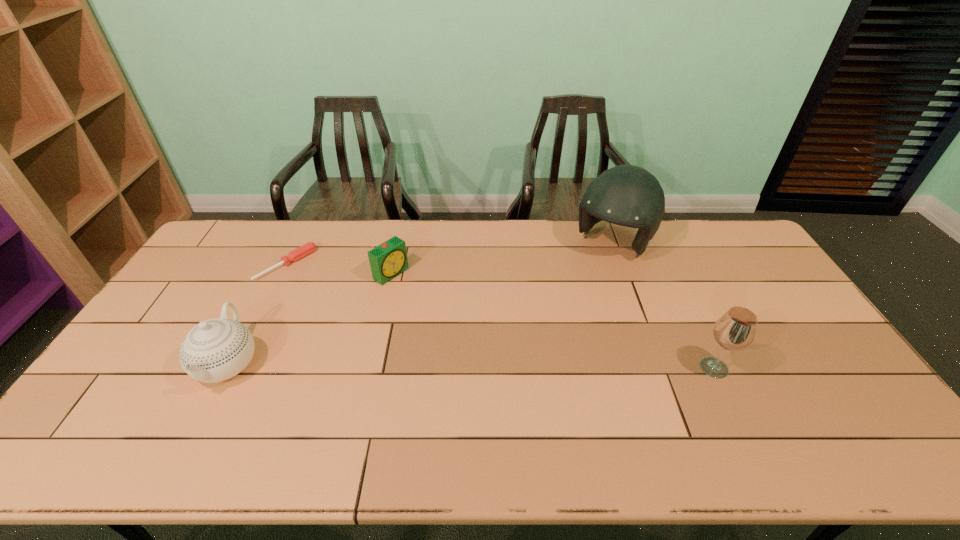
I want to click on free space on the desktop that is between the chinaware and the fourth shortest object and is positioned on the front-facing side of the second shortest object, so click(531, 366).

This screenshot has width=960, height=540. Identify the location of free space on the desktop that is between the third tallest object and the fourth shortest object and is positioned at the tip of the shortest object. [x=416, y=365].

You are a GUI agent. You are given a task and a screenshot of the screen. Output one action in this format:
    pyautogui.click(x=<x>, y=<y>)
    Task: Click on the vacant space on the desktop that is between the chinaware and the wineglass and is positioned at the face opening of the tallest object
    Image resolution: width=960 pixels, height=540 pixels.
    Given the screenshot: What is the action you would take?
    coord(516,366)